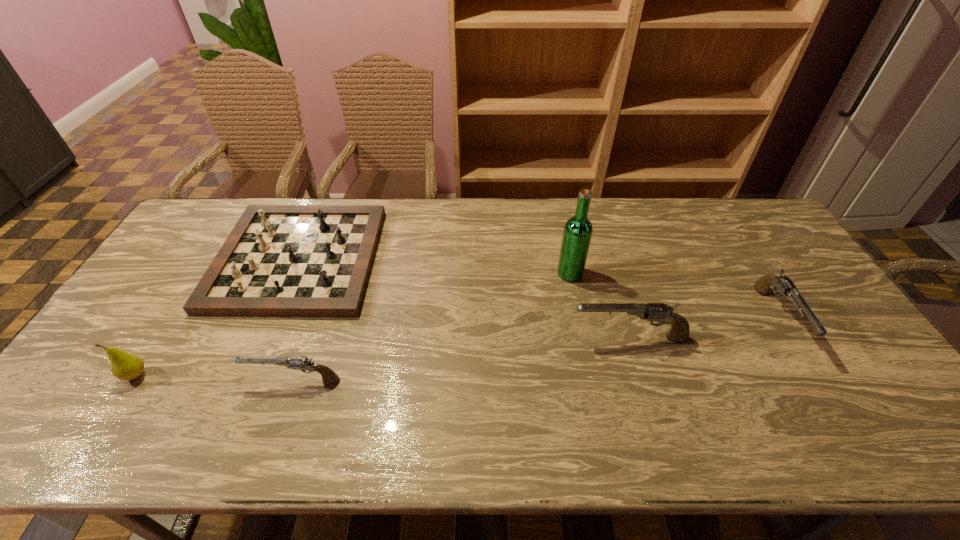
Please determine a free point for an extra gun to ensure balance. Please provide its 2D coordinates. Your answer should be formatted as a tuple, i.e. [(x, y)], where the tuple contains the x and y coordinates of a point satisfying the conditions above.

[(468, 358)]